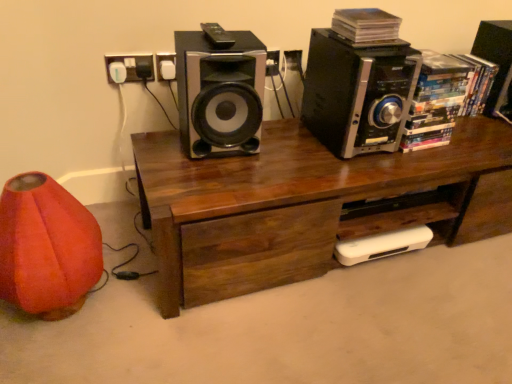
Where is `free space to the right of orange fabric bean bag chair at lower left`? The image size is (512, 384). free space to the right of orange fabric bean bag chair at lower left is located at coordinates (139, 321).